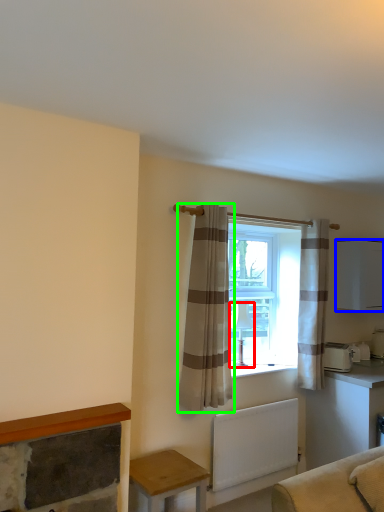
Question: Which object is the closest to the lamp (highlighted by a red box)? Choose among these: cabinetry (highlighted by a blue box) or curtain (highlighted by a green box).

Choices:
 (A) cabinetry
 (B) curtain

Answer: (B)